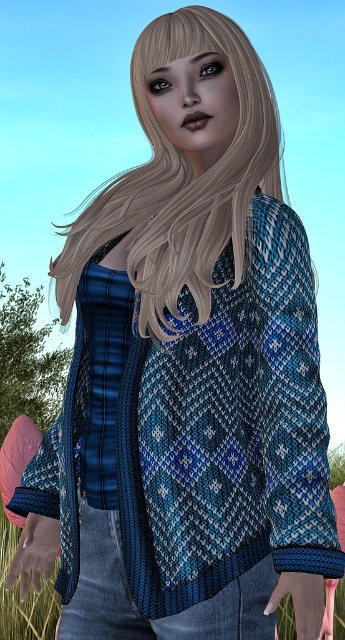
Between blondehair at center and green grass at lower left, which one has less height?

Standing shorter between the two is green grass at lower left.

Does blondehair at center have a smaller size compared to green grass at lower left?

Indeed, blondehair at center has a smaller size compared to green grass at lower left.

Where is `blondehair at center`? The image size is (345, 640). blondehair at center is located at coordinates (181, 180).

Describe the element at coordinates (181, 180) in the screenshot. I see `blondehair at center` at that location.

Who is higher up, blondehair at center or denim at center?

blondehair at center is higher up.

Where is `blondehair at center`? The image size is (345, 640). blondehair at center is located at coordinates (181, 180).

Which is in front, point (105, 592) or point (1, 595)?

Point (105, 592) is in front.

Can you confirm if denim at center is positioned below green grass at lower left?

Actually, denim at center is above green grass at lower left.

This screenshot has width=345, height=640. What are the coordinates of `denim at center` in the screenshot? It's located at (162, 616).

At what (x,y) coordinates should I click in order to perform the action: click on denim at center. Please return your answer as a coordinate pair (x, y). The width and height of the screenshot is (345, 640). Looking at the image, I should click on (162, 616).